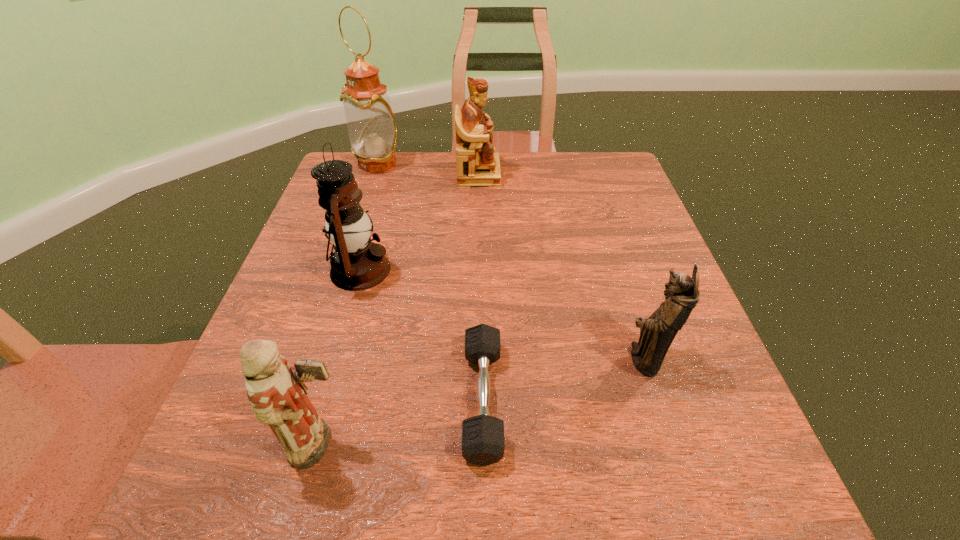
Find the location of a particular element. This screenshot has height=540, width=960. oil lamp is located at coordinates (372, 130).

At what (x,y) coordinates should I click in order to perform the action: click on the third farthest object. Please return your answer as a coordinate pair (x, y). The image size is (960, 540). Looking at the image, I should click on (357, 264).

What are the coordinates of `the farthest figurine` in the screenshot? It's located at (478, 165).

Where is `the leftmost figurine`? Image resolution: width=960 pixels, height=540 pixels. the leftmost figurine is located at coordinates (276, 391).

Identify the location of the second farthest figurine. (657, 332).

Find the location of a particular element. the rightmost object is located at coordinates (657, 332).

You are a GUI agent. You are given a task and a screenshot of the screen. Output one action in this format:
    pyautogui.click(x=<x>, y=<y>)
    Task: Click on the shortest object
    Image resolution: width=960 pixels, height=540 pixels.
    Given the screenshot: What is the action you would take?
    pyautogui.click(x=483, y=443)

Locate an element on the screen. This screenshot has width=960, height=540. vacant space located 0.170m on the right of the tallest object is located at coordinates (463, 164).

Identify the location of vacant region located 0.150m on the side of the lantern, there is a wick adjustment knob. (463, 270).

What are the coordinates of `free location located 0.060m on the front-facing side of the farthest figurine` in the screenshot? It's located at (522, 174).